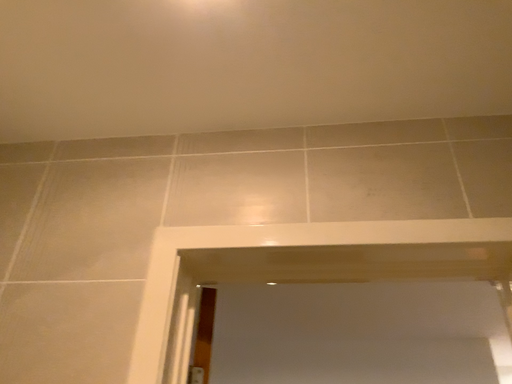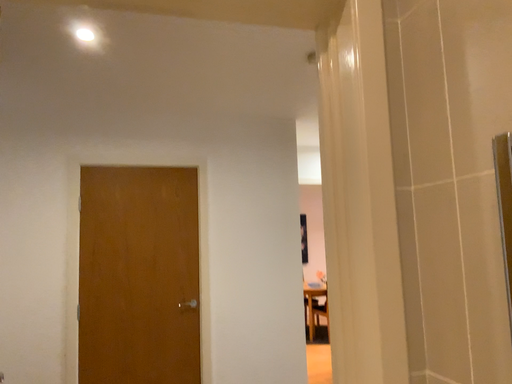
Question: Which way did the camera rotate in the video?

Choices:
 (A) rotated right
 (B) rotated left

Answer: (A)